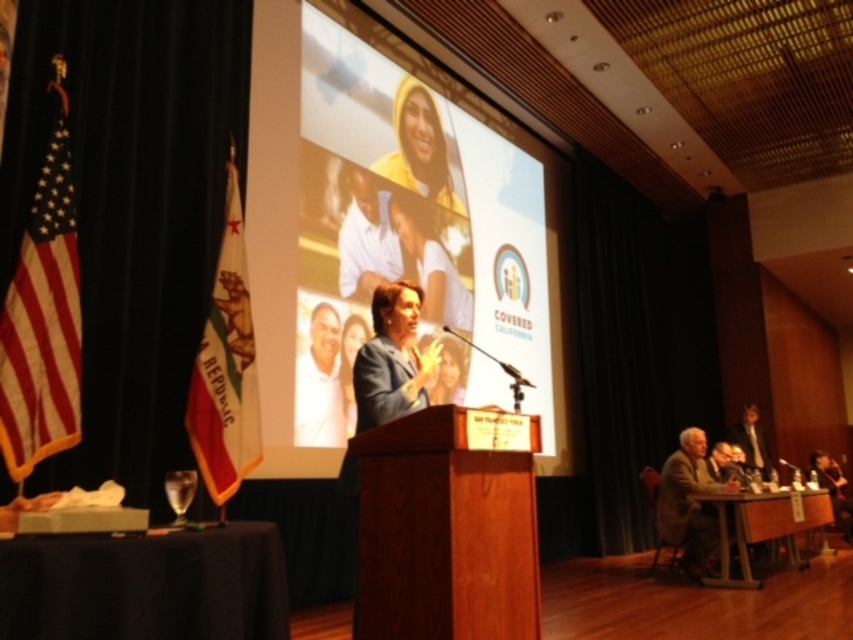
Question: Is matte plastic screen at center thinner than light brown wooden chair at lower right?

Choices:
 (A) yes
 (B) no

Answer: (B)

Question: Can you confirm if matte plastic screen at center is bigger than dark brown leather jacket at lower right?

Choices:
 (A) no
 (B) yes

Answer: (B)

Question: Is gray fabric suit at lower right wider than light brown wooden chair at lower right?

Choices:
 (A) no
 (B) yes

Answer: (B)

Question: Which object is the farthest from the matte blue suit at center?

Choices:
 (A) light brown wooden chair at lower right
 (B) white matte shirt at center

Answer: (A)

Question: Which point is farther from the camera taking this photo?

Choices:
 (A) (849, 528)
 (B) (405, 321)

Answer: (A)

Question: Which is farther from the light brown wooden chair at lower right?

Choices:
 (A) white matte shirt at center
 (B) dark brown leather jacket at lower right
 (C) matte blue suit at center
 (D) gray fabric suit at lower right

Answer: (C)